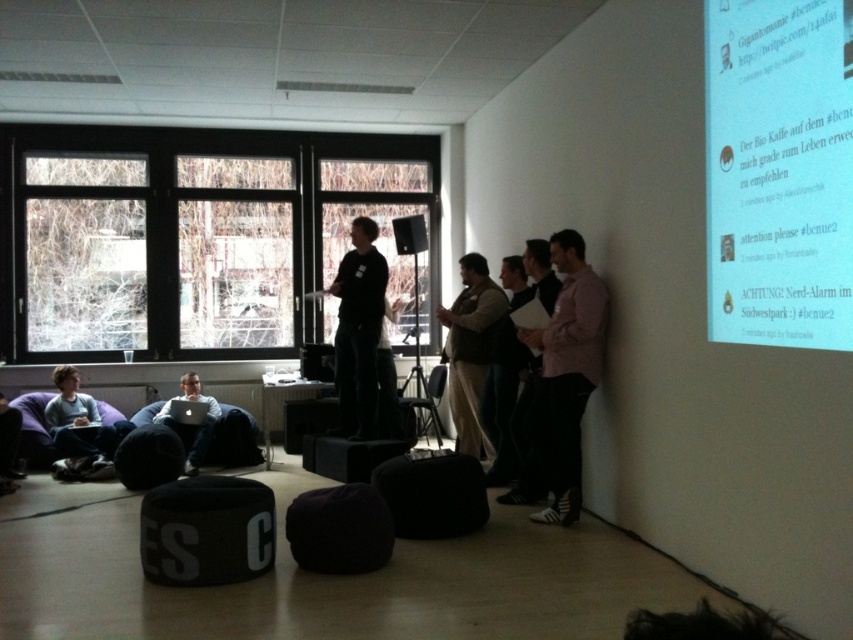
Question: Which point is farther from the camera taking this photo?

Choices:
 (A) (730, 92)
 (B) (100, 452)
 (C) (223, 529)

Answer: (B)

Question: Does white paper at upper right lie behind black matte speaker at center?

Choices:
 (A) yes
 (B) no

Answer: (B)

Question: Can you confirm if pink matte shirt at right is positioned below matte black laptop at lower left?

Choices:
 (A) no
 (B) yes

Answer: (A)

Question: Which is farther from the white paper at upper right?

Choices:
 (A) black matte speaker at center
 (B) black matte shirt at center
 (C) light blue fabric bean bag at lower left
 (D) pink matte shirt at right

Answer: (C)

Question: Is black fabric stool at lower center positioned in front of light blue fabric bean bag at lower left?

Choices:
 (A) yes
 (B) no

Answer: (A)

Question: Which of the following is the farthest from the observer?

Choices:
 (A) (587, 285)
 (B) (352, 257)

Answer: (B)